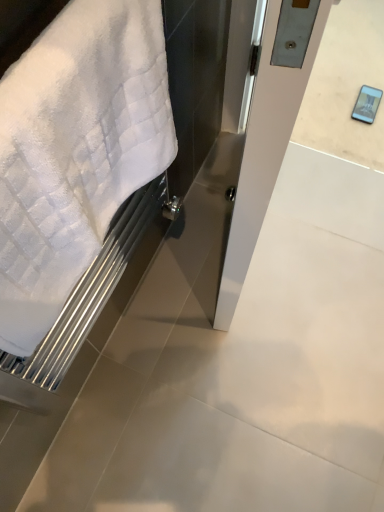
This screenshot has width=384, height=512. What do you see at coordinates (75, 151) in the screenshot?
I see `white soft towel at left` at bounding box center [75, 151].

The image size is (384, 512). In order to click on white soft towel at left in this screenshot , I will do `click(75, 151)`.

What do you see at coordinates (263, 153) in the screenshot? The image size is (384, 512). I see `satin silver door at center` at bounding box center [263, 153].

Where is `satin silver door at center`? The height and width of the screenshot is (512, 384). satin silver door at center is located at coordinates (263, 153).

At what (x,y) coordinates should I click in order to perform the action: click on white soft towel at left. Please return your answer as a coordinate pair (x, y). Looking at the image, I should click on (75, 151).

Between satin silver door at center and white soft towel at left, which one appears on the left side from the viewer's perspective?

From the viewer's perspective, white soft towel at left appears more on the left side.

Is satin silver door at center further to camera compared to white soft towel at left?

Yes, satin silver door at center is further from the viewer.

Is point (268, 138) closer to camera compared to point (151, 72)?

Yes.

From the image's perspective, would you say satin silver door at center is positioned over white soft towel at left?

Indeed, from the image's perspective, satin silver door at center is shown above white soft towel at left.

Consider the image. From a real-world perspective, is satin silver door at center positioned above or below white soft towel at left?

From a real-world perspective, satin silver door at center is physically below white soft towel at left.

Which object is wider, satin silver door at center or white soft towel at left?

Wider between the two is satin silver door at center.

Considering the sizes of objects satin silver door at center and white soft towel at left in the image provided, who is shorter, satin silver door at center or white soft towel at left?

With less height is white soft towel at left.

Which of these two, satin silver door at center or white soft towel at left, is smaller?

Smaller between the two is white soft towel at left.

Can we say satin silver door at center lies outside white soft towel at left?

Indeed, satin silver door at center is completely outside white soft towel at left.

Are satin silver door at center and white soft towel at left making contact?

No, satin silver door at center is not touching white soft towel at left.

Is satin silver door at center aimed at white soft towel at left?

No, satin silver door at center is not aimed at white soft towel at left.

How many degrees apart are the facing directions of satin silver door at center and white soft towel at left?

satin silver door at center and white soft towel at left are facing 13.1 degrees away from each other.

Where is `towel that appears on the left of satin silver door at center`? The image size is (384, 512). towel that appears on the left of satin silver door at center is located at coordinates (75, 151).

Is white soft towel at left at the left side of satin silver door at center?

Correct, you'll find white soft towel at left to the left of satin silver door at center.

In the image, is white soft towel at left positioned in front of or behind satin silver door at center?

white soft towel at left is positioned closer to the viewer than satin silver door at center.

Considering the points (52, 110) and (276, 116), which point is behind, point (52, 110) or point (276, 116)?

The point (276, 116) is more distant.

From the image's perspective, is white soft towel at left above or below satin silver door at center?

Clearly, from the image's perspective, white soft towel at left is below satin silver door at center.

In the scene shown: From a real-world perspective, is white soft towel at left above or below satin silver door at center?

In terms of real-world spatial position, white soft towel at left is above satin silver door at center.

Considering the sizes of white soft towel at left and satin silver door at center in the image, is white soft towel at left wider or thinner than satin silver door at center?

Considering their sizes, white soft towel at left looks slimmer than satin silver door at center.

Looking at this image, who is shorter, white soft towel at left or satin silver door at center?

white soft towel at left.

Is white soft towel at left bigger or smaller than satin silver door at center?

Clearly, white soft towel at left is smaller in size than satin silver door at center.

Is satin silver door at center inside white soft towel at left?

No, white soft towel at left does not contain satin silver door at center.

Is white soft towel at left with satin silver door at center?

No, white soft towel at left is not in contact with satin silver door at center.

Does white soft towel at left turn towards satin silver door at center?

No, white soft towel at left is not aimed at satin silver door at center.

Consider the image. How different are the orientations of white soft towel at left and satin silver door at center in degrees?

There is a 13.1-degree angle between the facing directions of white soft towel at left and satin silver door at center.

The width and height of the screenshot is (384, 512). I want to click on screen door that is under the white soft towel at left (from a real-world perspective), so click(x=263, y=153).

This screenshot has width=384, height=512. What are the coordinates of `towel below the satin silver door at center (from the image's perspective)` in the screenshot? It's located at (75, 151).

Where is `towel above the satin silver door at center (from a real-world perspective)`? towel above the satin silver door at center (from a real-world perspective) is located at coordinates (75, 151).